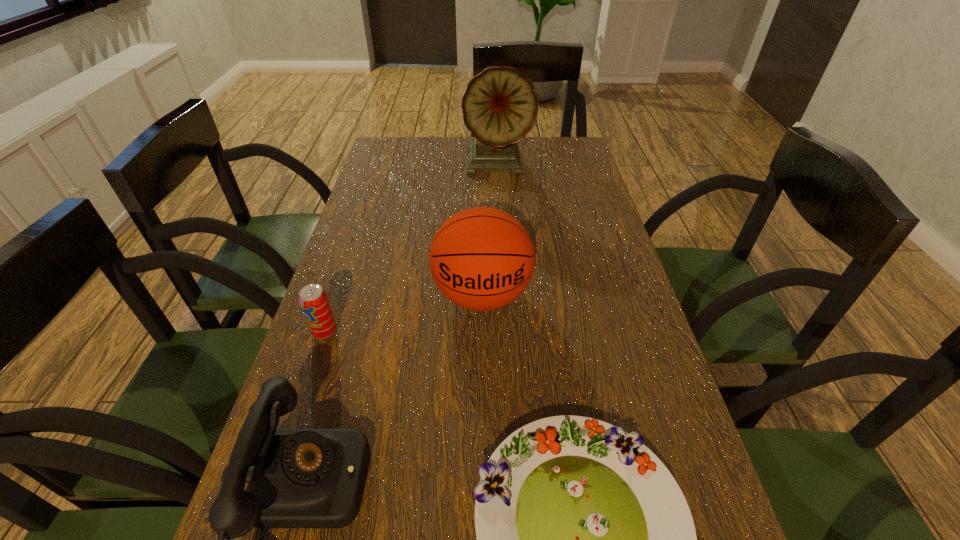
The width and height of the screenshot is (960, 540). Identify the location of record player. (500, 105).

This screenshot has width=960, height=540. I want to click on the farthest object, so click(x=500, y=105).

In order to click on basketball in this screenshot , I will do `click(482, 258)`.

Where is `soda can`? This screenshot has height=540, width=960. soda can is located at coordinates (313, 299).

You are a GUI agent. You are given a task and a screenshot of the screen. Output one action in this format:
    pyautogui.click(x=<x>, y=<y>)
    Task: Click on the free space located from the horn of the farthest object
    This screenshot has height=540, width=960.
    Given the screenshot: What is the action you would take?
    pyautogui.click(x=500, y=212)

The image size is (960, 540). What are the coordinates of `vacant area situated 0.180m on the side with logo of the basketball` in the screenshot? It's located at (483, 406).

Locate an element on the screen. This screenshot has height=540, width=960. vacant space located 0.210m on the right of the soda can is located at coordinates [433, 332].

Image resolution: width=960 pixels, height=540 pixels. Find the location of `object present at the far edge`. object present at the far edge is located at coordinates (500, 105).

What are the coordinates of `object situated at the left edge` in the screenshot? It's located at (313, 299).

The width and height of the screenshot is (960, 540). Identify the location of vacant point at the far edge. coord(439,141).